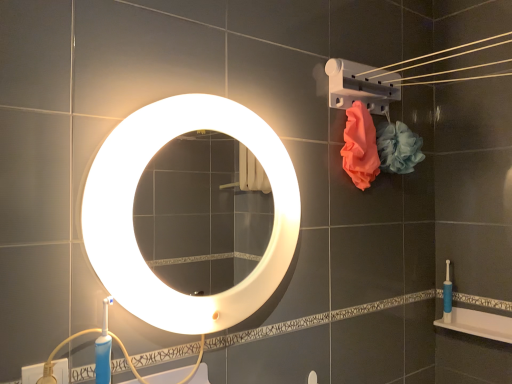
The height and width of the screenshot is (384, 512). Describe the element at coordinates (132, 214) in the screenshot. I see `white glossy mirror at center` at that location.

Measure the distance between white glossy mirror at center and camera.

white glossy mirror at center is 81.78 centimeters away from camera.

In order to face matte orange towel at upper right, which ranks as the 2th flower in right-to-left order, should I rotate leftwards or rightwards?

To align with it, rotate right about 14.805°.

Locate an element on the screen. The width and height of the screenshot is (512, 384). white glossy bath at lower right is located at coordinates (478, 324).

This screenshot has height=384, width=512. Describe the element at coordinates (478, 324) in the screenshot. I see `white glossy bath at lower right` at that location.

Find the location of a particular element. Image resolution: width=512 pixels, height=384 pixels. soft pink mesh sponge at upper right, positioned as the 2th flower in left-to-right order is located at coordinates (398, 147).

Considering their positions, is white glossy mirror at center located in front of or behind soft pink mesh sponge at upper right, positioned as the 2th flower in left-to-right order?

white glossy mirror at center is positioned closer to the viewer than soft pink mesh sponge at upper right, positioned as the 2th flower in left-to-right order.

Is point (162, 303) positioned behind point (413, 163)?

No.

Is white glossy mirror at center surrounding soft pink mesh sponge at upper right, which ranks as the first flower in right-to-left order?

No, soft pink mesh sponge at upper right, which ranks as the first flower in right-to-left order, is not surrounded by white glossy mirror at center.

Which of these two, white glossy mirror at center or soft pink mesh sponge at upper right, positioned as the 2th flower in left-to-right order, is smaller?

With smaller size is soft pink mesh sponge at upper right, positioned as the 2th flower in left-to-right order.

Is soft pink mesh sponge at upper right, which ranks as the first flower in right-to-left order, wider or thinner than blue rubber toilet brush at right?

In the image, soft pink mesh sponge at upper right, which ranks as the first flower in right-to-left order, appears to be wider than blue rubber toilet brush at right.

Is blue rubber toilet brush at right at the back of soft pink mesh sponge at upper right, which ranks as the first flower in right-to-left order?

No, soft pink mesh sponge at upper right, which ranks as the first flower in right-to-left order,'s orientation is not away from blue rubber toilet brush at right.

Looking at this image, considering the positions of objects soft pink mesh sponge at upper right, which ranks as the first flower in right-to-left order, and blue rubber toilet brush at right in the image provided, who is behind, soft pink mesh sponge at upper right, which ranks as the first flower in right-to-left order, or blue rubber toilet brush at right?

blue rubber toilet brush at right is more distant.

Is soft pink mesh sponge at upper right, which ranks as the first flower in right-to-left order, next to blue rubber toilet brush at right?

No, soft pink mesh sponge at upper right, which ranks as the first flower in right-to-left order, is not next to blue rubber toilet brush at right.

Considering the relative sizes of soft pink mesh sponge at upper right, positioned as the 2th flower in left-to-right order, and matte orange towel at upper right, which ranks as the 2th flower in right-to-left order, in the image provided, is soft pink mesh sponge at upper right, positioned as the 2th flower in left-to-right order, shorter than matte orange towel at upper right, which ranks as the 2th flower in right-to-left order,?

Yes.

Between soft pink mesh sponge at upper right, which ranks as the first flower in right-to-left order, and matte orange towel at upper right, placed as the 1th flower when sorted from left to right, which one has smaller width?

matte orange towel at upper right, placed as the 1th flower when sorted from left to right.

Is soft pink mesh sponge at upper right, which ranks as the first flower in right-to-left order, closer to the viewer compared to matte orange towel at upper right, which ranks as the 2th flower in right-to-left order?

No, it is behind matte orange towel at upper right, which ranks as the 2th flower in right-to-left order.

Is matte orange towel at upper right, placed as the 1th flower when sorted from left to right, positioned before white glossy bath at lower right?

That is True.

Measure the distance between matte orange towel at upper right, placed as the 1th flower when sorted from left to right, and white glossy bath at lower right.

matte orange towel at upper right, placed as the 1th flower when sorted from left to right, and white glossy bath at lower right are 26.86 inches apart from each other.

From the image's perspective, relative to white glossy bath at lower right, is matte orange towel at upper right, which ranks as the 2th flower in right-to-left order, above or below?

matte orange towel at upper right, which ranks as the 2th flower in right-to-left order, is above white glossy bath at lower right.

Which is in front, point (365, 182) or point (499, 330)?

The point (365, 182) is in front.

In the scene shown: Considering the sizes of objects soft pink mesh sponge at upper right, positioned as the 2th flower in left-to-right order, and white glossy bath at lower right in the image provided, who is thinner, soft pink mesh sponge at upper right, positioned as the 2th flower in left-to-right order, or white glossy bath at lower right?

With smaller width is white glossy bath at lower right.

Is soft pink mesh sponge at upper right, which ranks as the first flower in right-to-left order, bigger than white glossy bath at lower right?

Yes.

Is soft pink mesh sponge at upper right, positioned as the 2th flower in left-to-right order, oriented away from white glossy bath at lower right?

That's not correct — soft pink mesh sponge at upper right, positioned as the 2th flower in left-to-right order, is not looking away from white glossy bath at lower right.

Which object is positioned more to the right, soft pink mesh sponge at upper right, which ranks as the first flower in right-to-left order, or white glossy bath at lower right?

From the viewer's perspective, white glossy bath at lower right appears more on the right side.

What's the angular difference between white glossy mirror at center and matte orange towel at upper right, which ranks as the 2th flower in right-to-left order,'s facing directions?

There is a 1.98-degree angle between the facing directions of white glossy mirror at center and matte orange towel at upper right, which ranks as the 2th flower in right-to-left order.

The height and width of the screenshot is (384, 512). Identify the location of the 1st flower behind when counting from the white glossy mirror at center. (360, 146).

Relative to matte orange towel at upper right, which ranks as the 2th flower in right-to-left order, is white glossy mirror at center in front or behind?

In the image, white glossy mirror at center appears in front of matte orange towel at upper right, which ranks as the 2th flower in right-to-left order.

Based on their sizes in the image, would you say blue rubber toilet brush at right is bigger or smaller than white glossy bath at lower right?

Considering their sizes, blue rubber toilet brush at right takes up less space than white glossy bath at lower right.

How different are the orientations of blue rubber toilet brush at right and white glossy bath at lower right in degrees?

blue rubber toilet brush at right and white glossy bath at lower right are facing 3.12 degrees away from each other.

Considering the points (447, 267) and (487, 331), which point is in front, point (447, 267) or point (487, 331)?

Positioned in front is point (487, 331).

At what (x,y) coordinates should I click in order to perform the action: click on mirror that is below the soft pink mesh sponge at upper right, which ranks as the first flower in right-to-left order (from the image's perspective). Please return your answer as a coordinate pair (x, y). Image resolution: width=512 pixels, height=384 pixels. Looking at the image, I should click on pos(132,214).

Where is `toiletry below the soft pink mesh sponge at upper right, which ranks as the first flower in right-to-left order (from a real-world perspective)`? This screenshot has width=512, height=384. toiletry below the soft pink mesh sponge at upper right, which ranks as the first flower in right-to-left order (from a real-world perspective) is located at coordinates (447, 295).

Considering their positions, is blue rubber toilet brush at right positioned further to white glossy bath at lower right than white glossy mirror at center?

Based on the image, white glossy mirror at center appears to be further to white glossy bath at lower right.

Which object lies further to the anchor point blue rubber toilet brush at right, white glossy bath at lower right or white glossy mirror at center?

white glossy mirror at center is further to blue rubber toilet brush at right.

When comparing their distances from soft pink mesh sponge at upper right, which ranks as the first flower in right-to-left order, does white glossy mirror at center or matte orange towel at upper right, placed as the 1th flower when sorted from left to right, seem closer?

matte orange towel at upper right, placed as the 1th flower when sorted from left to right, is closer to soft pink mesh sponge at upper right, which ranks as the first flower in right-to-left order.

From the image, which object appears to be farther from white glossy bath at lower right, blue rubber toilet brush at right or soft pink mesh sponge at upper right, positioned as the 2th flower in left-to-right order?

soft pink mesh sponge at upper right, positioned as the 2th flower in left-to-right order, is further to white glossy bath at lower right.

Which object lies further to the anchor point white glossy bath at lower right, white glossy mirror at center or soft pink mesh sponge at upper right, which ranks as the first flower in right-to-left order?

Based on the image, white glossy mirror at center appears to be further to white glossy bath at lower right.

Considering their positions, is soft pink mesh sponge at upper right, positioned as the 2th flower in left-to-right order, positioned further to white glossy mirror at center than white glossy bath at lower right?

white glossy bath at lower right is further to white glossy mirror at center.

Considering their positions, is white glossy mirror at center positioned further to blue rubber toilet brush at right than matte orange towel at upper right, which ranks as the 2th flower in right-to-left order?

Based on the image, white glossy mirror at center appears to be further to blue rubber toilet brush at right.

Estimate the real-world distances between objects in this image. Which object is closer to blue rubber toilet brush at right, white glossy bath at lower right or matte orange towel at upper right, which ranks as the 2th flower in right-to-left order?

white glossy bath at lower right lies closer to blue rubber toilet brush at right than the other object.

What are the coordinates of `flower between white glossy mirror at center and soft pink mesh sponge at upper right, positioned as the 2th flower in left-to-right order, in the horizontal direction` in the screenshot? It's located at (360, 146).

This screenshot has height=384, width=512. What are the coordinates of `toiletry that lies between matte orange towel at upper right, placed as the 1th flower when sorted from left to right, and white glossy bath at lower right from top to bottom` in the screenshot? It's located at (447, 295).

Where is `toiletry between soft pink mesh sponge at upper right, positioned as the 2th flower in left-to-right order, and white glossy bath at lower right, in the vertical direction`? toiletry between soft pink mesh sponge at upper right, positioned as the 2th flower in left-to-right order, and white glossy bath at lower right, in the vertical direction is located at coordinates (447, 295).

Where is `flower that lies between soft pink mesh sponge at upper right, positioned as the 2th flower in left-to-right order, and white glossy bath at lower right from top to bottom`? Image resolution: width=512 pixels, height=384 pixels. flower that lies between soft pink mesh sponge at upper right, positioned as the 2th flower in left-to-right order, and white glossy bath at lower right from top to bottom is located at coordinates (360, 146).